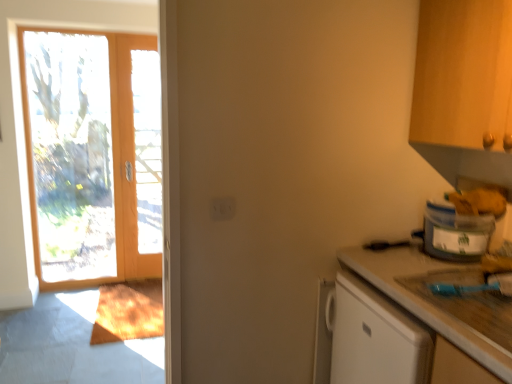
Question: Is the position of matte wooden screen door at left less distant than that of clear glass door at left?

Choices:
 (A) no
 (B) yes

Answer: (A)

Question: Is matte wooden screen door at left located outside clear glass door at left?

Choices:
 (A) no
 (B) yes

Answer: (B)

Question: From a real-world perspective, is matte wooden screen door at left beneath clear glass door at left?

Choices:
 (A) no
 (B) yes

Answer: (A)

Question: Considering the relative sizes of matte wooden screen door at left and clear glass door at left in the image provided, is matte wooden screen door at left bigger than clear glass door at left?

Choices:
 (A) yes
 (B) no

Answer: (B)

Question: Can you confirm if matte wooden screen door at left is shorter than clear glass door at left?

Choices:
 (A) yes
 (B) no

Answer: (A)

Question: From the image's perspective, would you say matte wooden screen door at left is shown under clear glass door at left?

Choices:
 (A) yes
 (B) no

Answer: (B)

Question: Is matte wooden screen door at left shorter than smooth beige countertop at lower right?

Choices:
 (A) no
 (B) yes

Answer: (A)

Question: Considering the relative sizes of matte wooden screen door at left and smooth beige countertop at lower right in the image provided, is matte wooden screen door at left smaller than smooth beige countertop at lower right?

Choices:
 (A) no
 (B) yes

Answer: (B)

Question: Does matte wooden screen door at left touch smooth beige countertop at lower right?

Choices:
 (A) yes
 (B) no

Answer: (B)

Question: Can you confirm if matte wooden screen door at left is bigger than smooth beige countertop at lower right?

Choices:
 (A) no
 (B) yes

Answer: (A)

Question: From a real-world perspective, is matte wooden screen door at left over smooth beige countertop at lower right?

Choices:
 (A) yes
 (B) no

Answer: (A)

Question: Could you tell me if matte wooden screen door at left is facing smooth beige countertop at lower right?

Choices:
 (A) no
 (B) yes

Answer: (A)

Question: Considering the relative sizes of matte wooden screen door at left and translucent plastic container at right in the image provided, is matte wooden screen door at left wider than translucent plastic container at right?

Choices:
 (A) no
 (B) yes

Answer: (A)